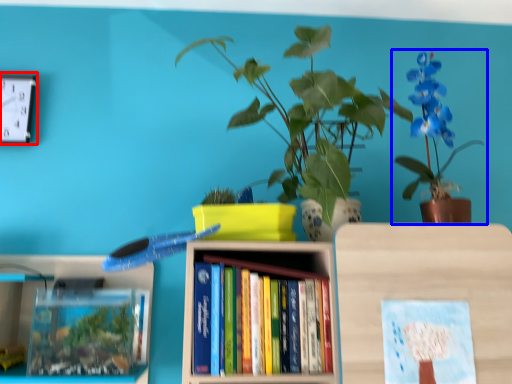
Question: Among these objects, which one is farthest to the camera, clock (highlighted by a red box) or houseplant (highlighted by a blue box)?

Choices:
 (A) clock
 (B) houseplant

Answer: (A)